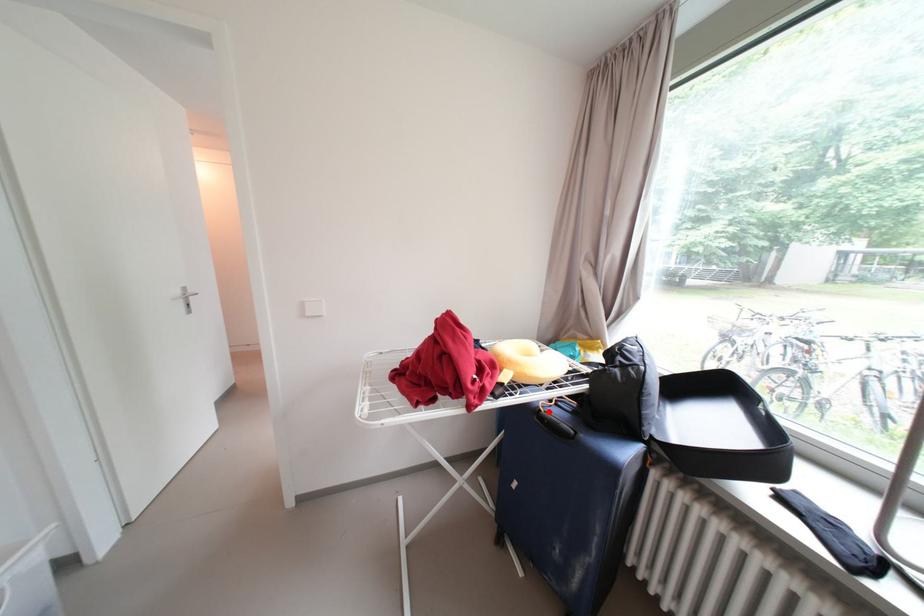
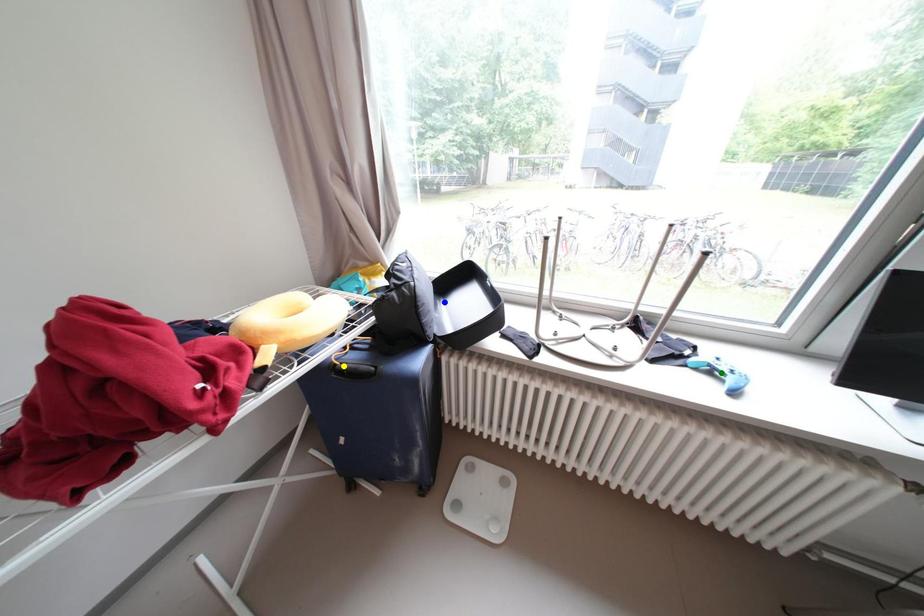
Question: I am providing you with two images of the same scene from different viewpoints. A red point is marked on the first image. You are given multiple points on the second image. Which spot in image 2 lines up with the point in image 1?

Choices:
 (A) blue point
 (B) green point
 (C) yellow point

Answer: (C)